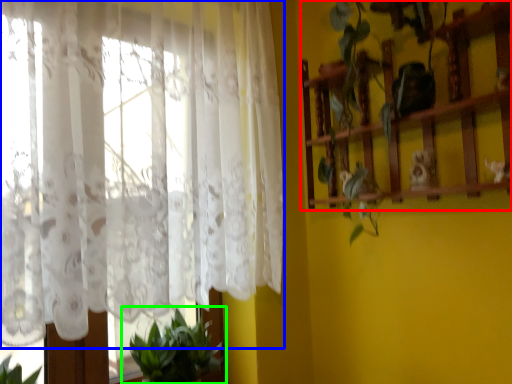
Question: Which object is positioned farthest from shelf (highlighted by a red box)? Select from curtain (highlighted by a blue box) and houseplant (highlighted by a green box).

Choices:
 (A) curtain
 (B) houseplant

Answer: (B)